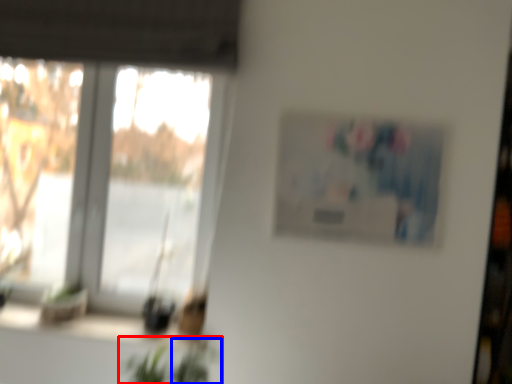
Question: Which object is closer to the camera taking this photo, houseplant (highlighted by a red box) or plant (highlighted by a blue box)?

Choices:
 (A) houseplant
 (B) plant

Answer: (A)